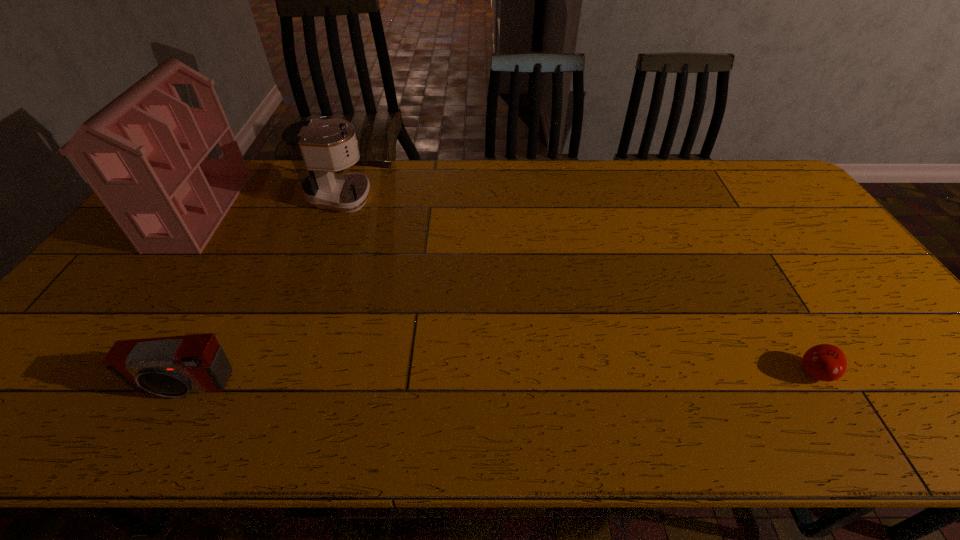
The width and height of the screenshot is (960, 540). Identify the location of vacant space in between the dollhouse and the coffee maker. (276, 205).

At what (x,y) coordinates should I click in order to perform the action: click on free space between the tallest object and the second tallest object. Please return your answer as a coordinate pair (x, y). Looking at the image, I should click on (276, 205).

At what (x,y) coordinates should I click in order to perform the action: click on vacant region between the second shortest object and the rightmost object. Please return your answer as a coordinate pair (x, y). Looking at the image, I should click on (500, 380).

At what (x,y) coordinates should I click in order to perform the action: click on free space between the camera and the leftmost object. Please return your answer as a coordinate pair (x, y). Looking at the image, I should click on (192, 299).

You are a GUI agent. You are given a task and a screenshot of the screen. Output one action in this format:
    pyautogui.click(x=<x>, y=<y>)
    Task: Click on the free space between the dollhouse and the coffee maker
    This screenshot has width=960, height=540.
    Given the screenshot: What is the action you would take?
    pyautogui.click(x=276, y=205)

You are a GUI agent. You are given a task and a screenshot of the screen. Output one action in this format:
    pyautogui.click(x=<x>, y=<y>)
    Task: Click on the vacant area between the third shortest object and the second shortest object
    The width and height of the screenshot is (960, 540).
    Given the screenshot: What is the action you would take?
    pyautogui.click(x=268, y=292)

This screenshot has height=540, width=960. I want to click on free space between the leftmost object and the coffee maker, so click(x=276, y=205).

Locate an element on the screen. vacant space that's between the second shortest object and the dollhouse is located at coordinates (192, 299).

Identify which object is located as the nearest to the leftmost object. Please provide its 2D coordinates. Your answer should be formatted as a tuple, i.e. [(x, y)], where the tuple contains the x and y coordinates of a point satisfying the conditions above.

[(317, 148)]

Identify which object is the third closest to the shortest object. Please provide its 2D coordinates. Your answer should be formatted as a tuple, i.e. [(x, y)], where the tuple contains the x and y coordinates of a point satisfying the conditions above.

[(145, 154)]